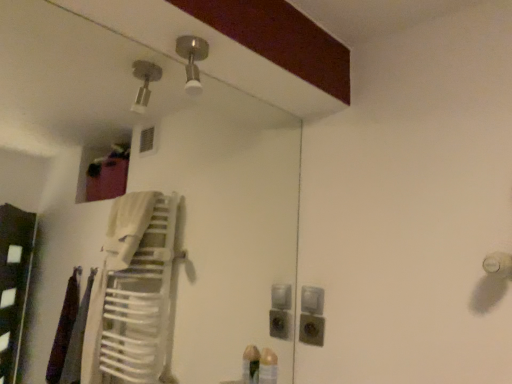
Question: Can you confirm if matte gray outlet at lower center is shorter than satin nickel light fixture at upper center?

Choices:
 (A) yes
 (B) no

Answer: (A)

Question: Is matte gray outlet at lower center turned away from satin nickel light fixture at upper center?

Choices:
 (A) yes
 (B) no

Answer: (B)

Question: From the image's perspective, is matte gray outlet at lower center located above satin nickel light fixture at upper center?

Choices:
 (A) yes
 (B) no

Answer: (B)

Question: Is matte gray outlet at lower center closer to the viewer compared to satin nickel light fixture at upper center?

Choices:
 (A) no
 (B) yes

Answer: (A)

Question: From the image's perspective, is matte gray outlet at lower center beneath satin nickel light fixture at upper center?

Choices:
 (A) yes
 (B) no

Answer: (A)

Question: Is matte gray outlet at lower center smaller than satin nickel light fixture at upper center?

Choices:
 (A) yes
 (B) no

Answer: (A)

Question: From the image's perspective, does satin silver switch at center appear lower than satin nickel light fixture at upper center?

Choices:
 (A) yes
 (B) no

Answer: (A)

Question: Can you confirm if satin silver switch at center is wider than satin nickel light fixture at upper center?

Choices:
 (A) yes
 (B) no

Answer: (B)

Question: Considering the relative positions of satin silver switch at center and satin nickel light fixture at upper center in the image provided, is satin silver switch at center in front of satin nickel light fixture at upper center?

Choices:
 (A) yes
 (B) no

Answer: (B)

Question: Is satin silver switch at center bigger than satin nickel light fixture at upper center?

Choices:
 (A) no
 (B) yes

Answer: (A)

Question: From the image's perspective, is satin silver switch at center on top of satin nickel light fixture at upper center?

Choices:
 (A) yes
 (B) no

Answer: (B)

Question: Does satin silver switch at center appear on the right side of satin nickel light fixture at upper center?

Choices:
 (A) yes
 (B) no

Answer: (A)

Question: Is satin nickel light fixture at upper center further to the viewer compared to satin silver switch at center?

Choices:
 (A) yes
 (B) no

Answer: (B)